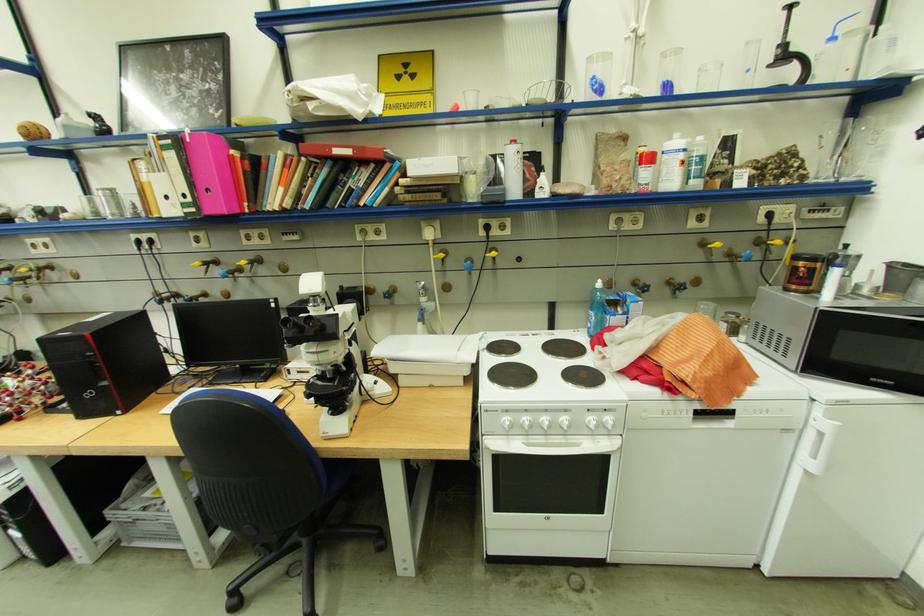
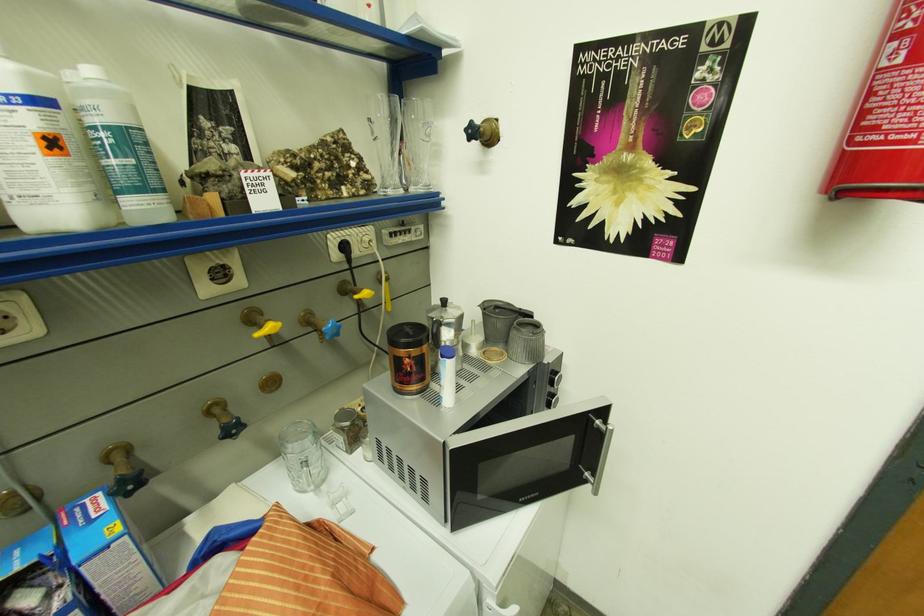
Locate, in the second image, the point that corresponds to pixel 737 261 in the first image.

(322, 331)